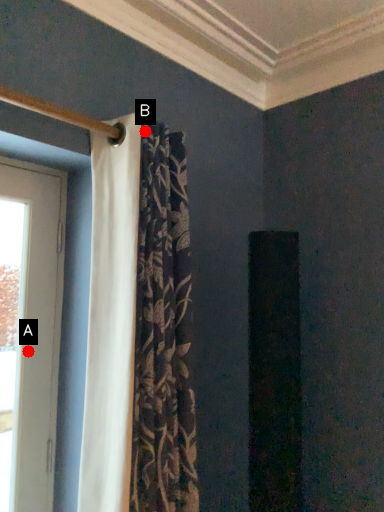
Question: Two points are circled on the image, labeled by A and B beside each circle. Which point is farther to the camera?

Choices:
 (A) A is further
 (B) B is further

Answer: (A)